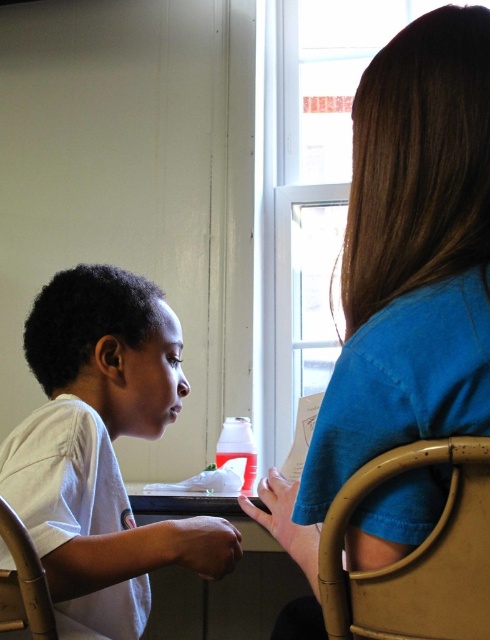
Question: Does wooden chair at lower right have a lesser width compared to smooth wooden table at center?

Choices:
 (A) no
 (B) yes

Answer: (B)

Question: Which point appears farthest from the camera in this image?

Choices:
 (A) (345, 616)
 (B) (228, 612)

Answer: (B)

Question: Is smooth wooden table at center wider than wooden chair at lower left?

Choices:
 (A) no
 (B) yes

Answer: (B)

Question: Can you confirm if white matte shirt at left is smaller than wooden chair at lower left?

Choices:
 (A) no
 (B) yes

Answer: (A)

Question: Which point is farther to the camera?

Choices:
 (A) (98, 432)
 (B) (421, 604)

Answer: (A)

Question: Which point appears farthest from the camera in this image?

Choices:
 (A) (488, 476)
 (B) (42, 570)

Answer: (B)